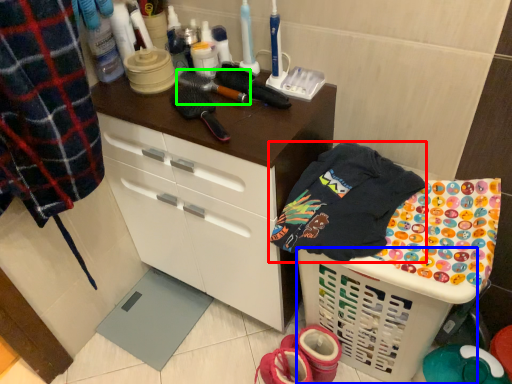
Question: Based on their relative distances, which object is nearer to clothing (highlighted by a red box)? Choose from basket (highlighted by a blue box) and brush (highlighted by a green box).

Choices:
 (A) basket
 (B) brush

Answer: (A)